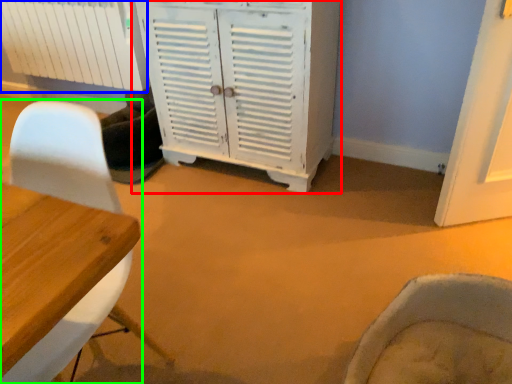
Question: Estimate the real-world distances between objects in this image. Which object is closer to cabinetry (highlighted by a red box), radiator (highlighted by a blue box) or chair (highlighted by a green box)?

Choices:
 (A) radiator
 (B) chair

Answer: (A)